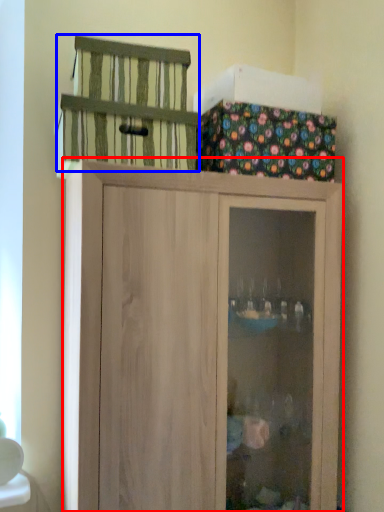
Question: Among these objects, which one is nearest to the camera, cupboard (highlighted by a red box) or cage (highlighted by a blue box)?

Choices:
 (A) cupboard
 (B) cage

Answer: (A)